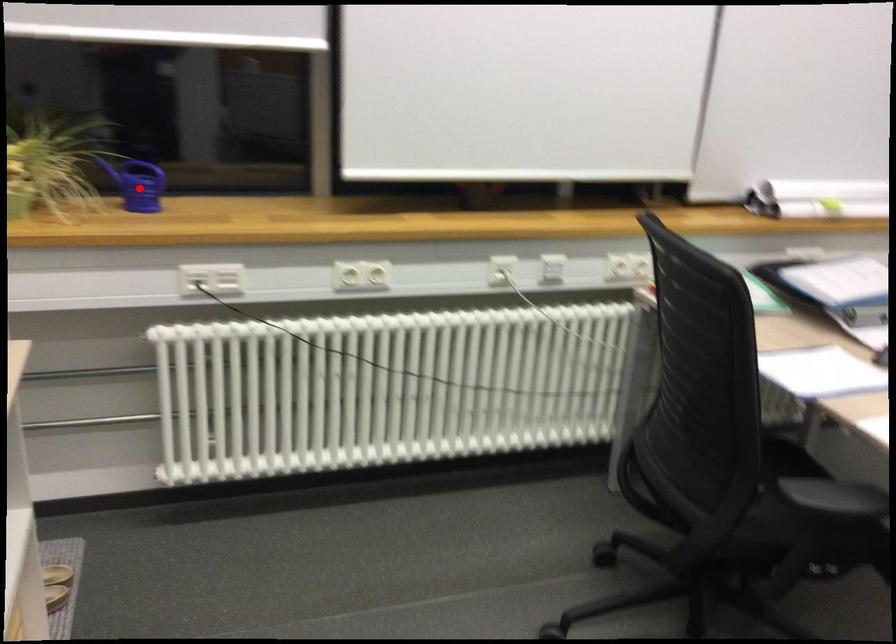
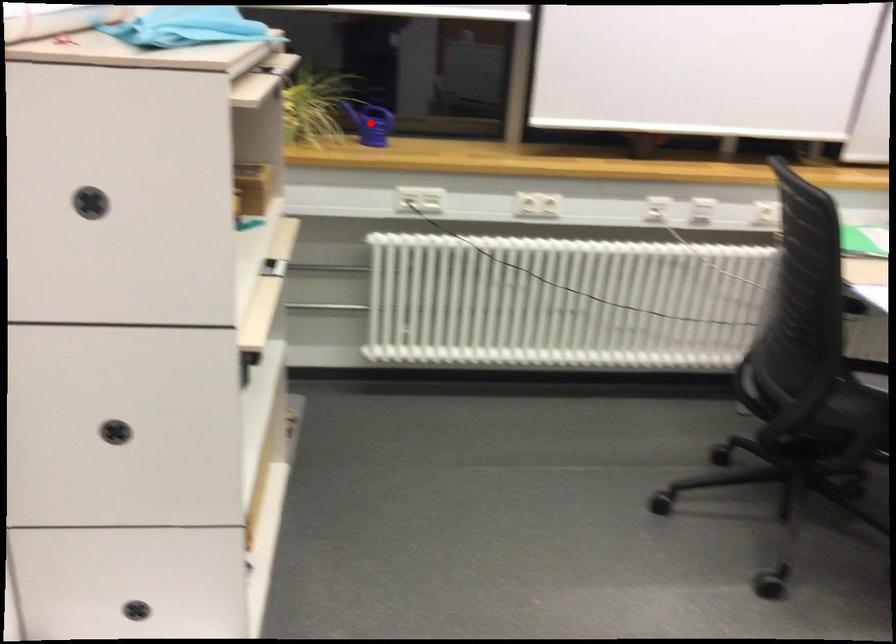
I am providing you with two images of the same scene from different viewpoints. A red point is marked on the first image and another point is marked on the second image. Is the marked point in image1 the same physical position as the marked point in image2?

Yes